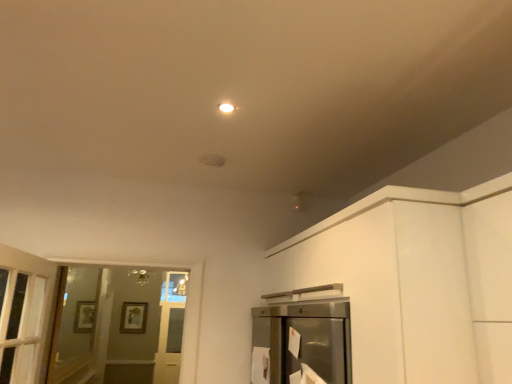
Question: Is white glossy light fixture at upper center inside the boundaries of clear glass screen door at left, or outside?

Choices:
 (A) outside
 (B) inside

Answer: (A)

Question: From the image's perspective, relative to clear glass screen door at left, is white glossy light fixture at upper center above or below?

Choices:
 (A) above
 (B) below

Answer: (A)

Question: From a real-world perspective, is white glossy light fixture at upper center above or below clear glass screen door at left?

Choices:
 (A) above
 (B) below

Answer: (A)

Question: Is clear glass screen door at left inside or outside of white glossy light fixture at upper center?

Choices:
 (A) outside
 (B) inside

Answer: (A)

Question: Considering the positions of clear glass screen door at left and white glossy light fixture at upper center in the image, is clear glass screen door at left taller or shorter than white glossy light fixture at upper center?

Choices:
 (A) tall
 (B) short

Answer: (A)

Question: In the image, is clear glass screen door at left positioned in front of or behind white glossy light fixture at upper center?

Choices:
 (A) front
 (B) behind

Answer: (B)

Question: Does point (57, 364) appear closer or farther from the camera than point (229, 102)?

Choices:
 (A) closer
 (B) farther

Answer: (B)